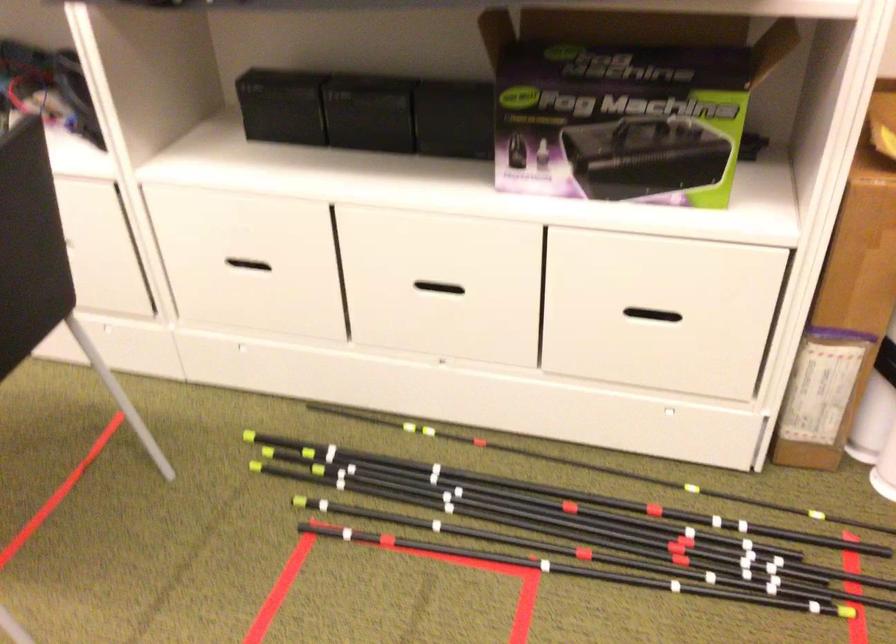
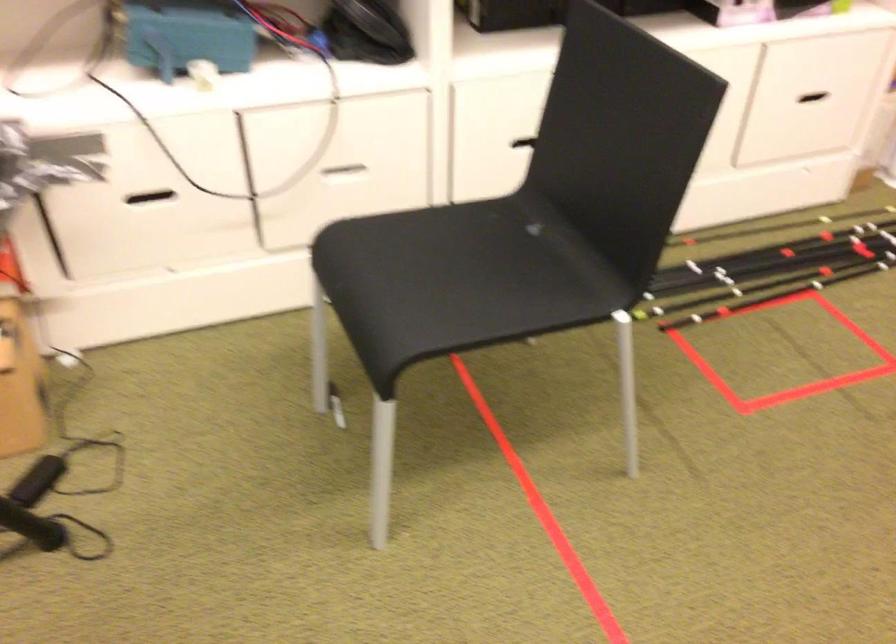
The point at [643,324] is marked in the first image. Where is the corresponding point in the second image?

(806, 102)